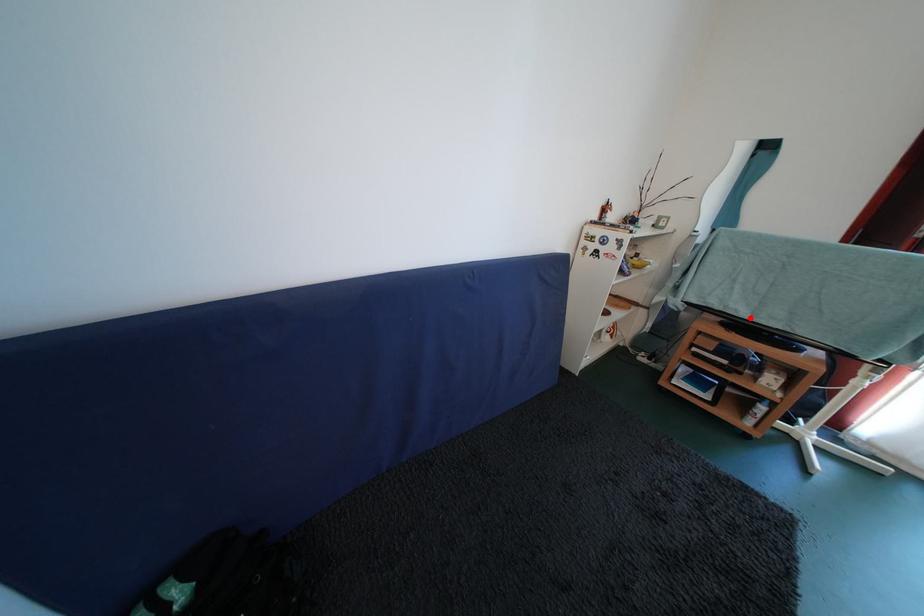
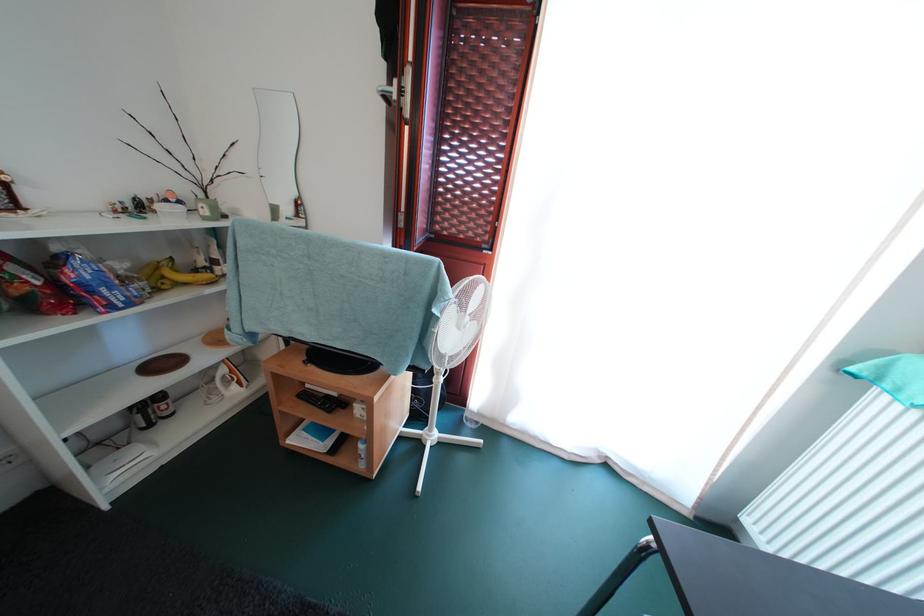
In the second image, find the point that corresponds to the highlighted location in the first image.

(318, 341)